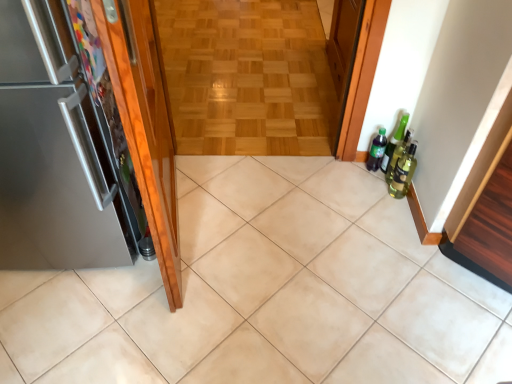
At what (x,y) coordinates should I click in order to perform the action: click on free space in front of green matte bottle at right. Please return your answer as a coordinate pair (x, y). This screenshot has height=384, width=512. Looking at the image, I should click on (371, 193).